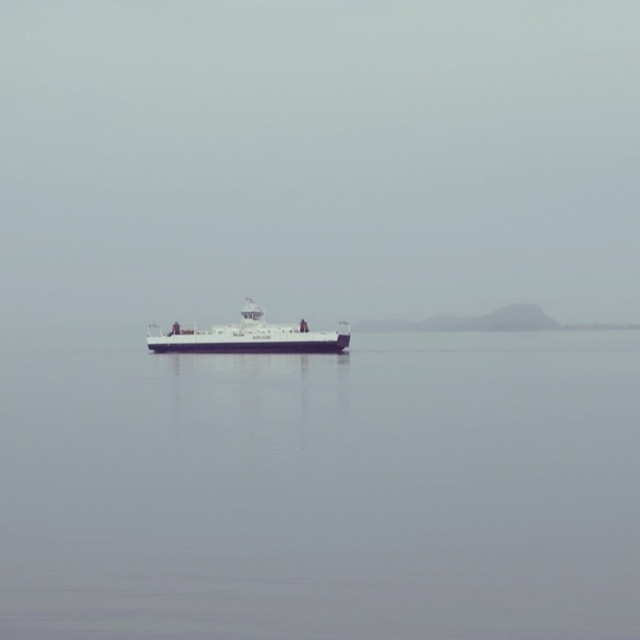
Which is below, smooth gray water at center or white matte ship at center?

smooth gray water at center

Find the location of a particular element. smooth gray water at center is located at coordinates (324, 490).